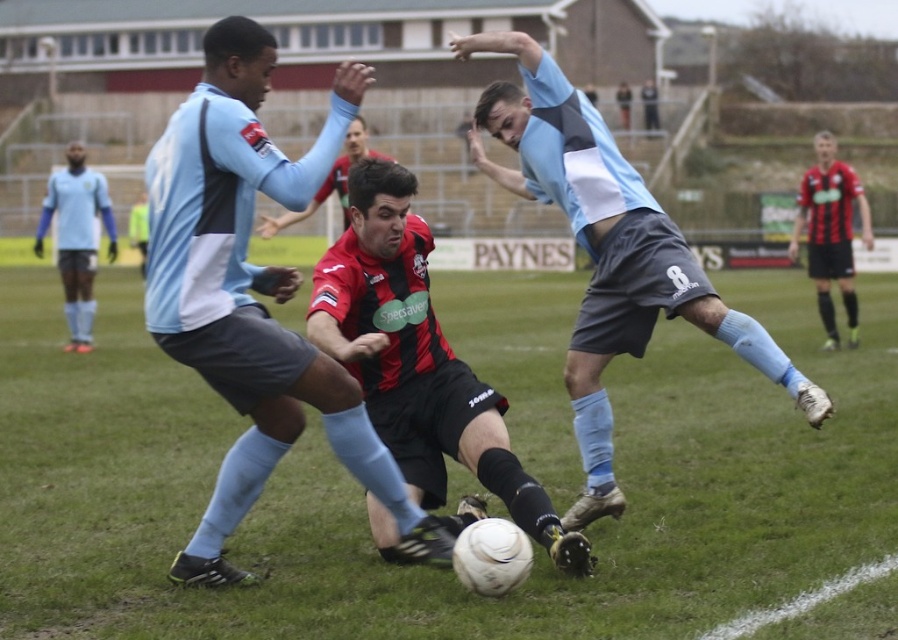
You are a soccer coach analyzing the game from the sidelines. You notice a point at coordinates (x=776, y=380) on the field. If you want to place a cone exactly 6 meters away from where you are standing, would placing it at that point work?

The point at coordinates (x=776, y=380) is 6.03 meters from the camera, so placing a cone there would be approximately 6 meters away, which should work.

You are a soccer player in the red jersey trying to pass the ball to your teammate. The ball is at your feet, and you notice the matte blue shorts at center, which belongs to an opponent. Where should you aim your pass to avoid the opponent?

You should aim your pass away from the matte blue shorts at center, which is located at point (251, 296). Passing to the opposite direction of that position would help avoid the opponent.

You are a soccer player trying to pass the ball to a teammate. The ball is at point (712, 291) and you want to pass it to a teammate at point (77, 328). Considering the positions of the two points, will the ball travel towards the viewer or away from the viewer during the pass?

The ball will travel away from the viewer during the pass because point (712, 291) is closer to the viewer than point (77, 328).